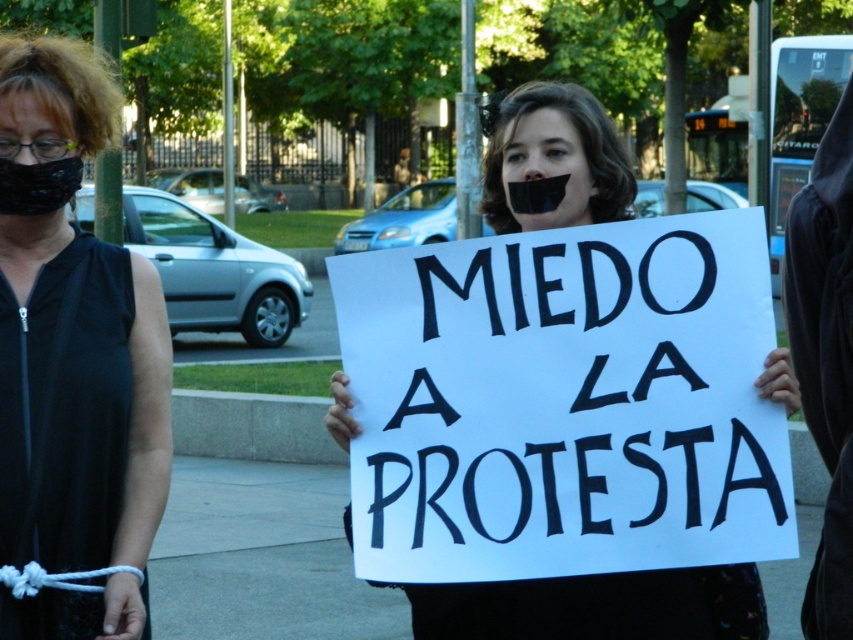
Question: Is black fabric mask at left below black fabric at center?

Choices:
 (A) no
 (B) yes

Answer: (A)

Question: Estimate the real-world distances between objects in this image. Which object is farther from the black fabric at center?

Choices:
 (A) black fabric mask at left
 (B) white paper sign at center

Answer: (A)

Question: Which object is the farthest from the black fabric mask at left?

Choices:
 (A) black fabric at center
 (B) white paper sign at center

Answer: (A)

Question: Can you confirm if black fabric mask at left is positioned above white paper sign at center?

Choices:
 (A) no
 (B) yes

Answer: (B)

Question: Is black fabric mask at left wider than white paper sign at center?

Choices:
 (A) no
 (B) yes

Answer: (A)

Question: Estimate the real-world distances between objects in this image. Which object is closer to the black fabric mask at left?

Choices:
 (A) black fabric at center
 (B) white paper sign at center

Answer: (B)